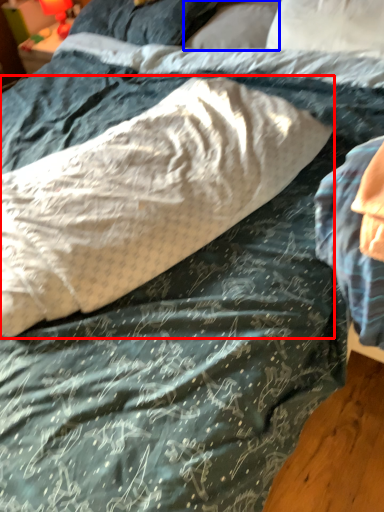
Question: Which of the following is the closest to the observer, pillow (highlighted by a red box) or pillow (highlighted by a blue box)?

Choices:
 (A) pillow
 (B) pillow

Answer: (A)